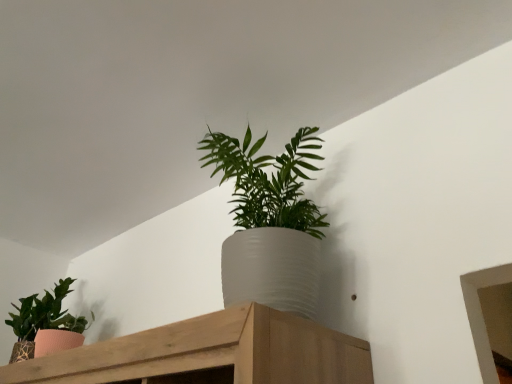
What are the coordinates of `white textured pot at center, which is the first houseplant in right-to-left order` in the screenshot? It's located at (269, 223).

This screenshot has height=384, width=512. Describe the element at coordinates (269, 223) in the screenshot. I see `white textured pot at center, the first houseplant from the front` at that location.

What is the approximate height of white textured pot at center, which is the first houseplant in right-to-left order?

22.92 inches.

Find the location of `textured pink pot at left, the 1th houseplant viewed from the left`. textured pink pot at left, the 1th houseplant viewed from the left is located at coordinates (46, 324).

Describe the element at coordinates (46, 324) in the screenshot. I see `textured pink pot at left, the 1th houseplant viewed from the left` at that location.

At what (x,y) coordinates should I click in order to perform the action: click on white textured pot at center, the first houseplant from the front. Please return your answer as a coordinate pair (x, y). The height and width of the screenshot is (384, 512). Looking at the image, I should click on (269, 223).

Considering the relative positions of textured pink pot at left, the second houseplant viewed from the front, and white textured pot at center, which ranks as the second houseplant in left-to-right order, in the image provided, is textured pink pot at left, the second houseplant viewed from the front, to the left or to the right of white textured pot at center, which ranks as the second houseplant in left-to-right order,?

From the image, it's evident that textured pink pot at left, the second houseplant viewed from the front, is to the left of white textured pot at center, which ranks as the second houseplant in left-to-right order.

Does textured pink pot at left, the 1th houseplant viewed from the left, lie behind white textured pot at center, which is the first houseplant in right-to-left order?

Yes, textured pink pot at left, the 1th houseplant viewed from the left, is further from the viewer.

Does point (48, 325) come farther from viewer compared to point (287, 150)?

Yes, it is behind point (287, 150).

From the image's perspective, is textured pink pot at left, the 1th houseplant viewed from the left, above or below white textured pot at center, positioned as the 2th houseplant in back-to-front order?

textured pink pot at left, the 1th houseplant viewed from the left, is situated lower than white textured pot at center, positioned as the 2th houseplant in back-to-front order, in the image.

From a real-world perspective, is textured pink pot at left, the second houseplant viewed from the front, positioned above or below white textured pot at center, positioned as the 2th houseplant in back-to-front order?

textured pink pot at left, the second houseplant viewed from the front, is below white textured pot at center, positioned as the 2th houseplant in back-to-front order.

Can you confirm if textured pink pot at left, the 1th houseplant viewed from the left, is thinner than white textured pot at center, which ranks as the second houseplant in left-to-right order?

Yes, textured pink pot at left, the 1th houseplant viewed from the left, is thinner than white textured pot at center, which ranks as the second houseplant in left-to-right order.

Looking at this image, in terms of height, does textured pink pot at left, the 1th houseplant viewed from the left, look taller or shorter compared to white textured pot at center, positioned as the 2th houseplant in back-to-front order?

Clearly, textured pink pot at left, the 1th houseplant viewed from the left, is shorter compared to white textured pot at center, positioned as the 2th houseplant in back-to-front order.

In the scene shown: Looking at the image, does textured pink pot at left, the second houseplant viewed from the front, seem bigger or smaller compared to white textured pot at center, the first houseplant from the front?

In the image, textured pink pot at left, the second houseplant viewed from the front, appears to be smaller than white textured pot at center, the first houseplant from the front.

Is textured pink pot at left, the second houseplant viewed from the front, situated inside white textured pot at center, which ranks as the second houseplant in left-to-right order, or outside?

textured pink pot at left, the second houseplant viewed from the front, cannot be found inside white textured pot at center, which ranks as the second houseplant in left-to-right order.

Does textured pink pot at left, the second houseplant viewed from the front, touch white textured pot at center, which is the first houseplant in right-to-left order?

No, textured pink pot at left, the second houseplant viewed from the front, is not beside white textured pot at center, which is the first houseplant in right-to-left order.

Is textured pink pot at left, placed as the 2th houseplant when sorted from right to left, oriented towards white textured pot at center, positioned as the 2th houseplant in back-to-front order?

No, textured pink pot at left, placed as the 2th houseplant when sorted from right to left, does not turn towards white textured pot at center, positioned as the 2th houseplant in back-to-front order.

How many degrees apart are the facing directions of textured pink pot at left, the second houseplant viewed from the front, and white textured pot at center, which is the first houseplant in right-to-left order?

The angular difference between textured pink pot at left, the second houseplant viewed from the front, and white textured pot at center, which is the first houseplant in right-to-left order, is 2.81 degrees.

Measure the distance from textured pink pot at left, placed as the 1th houseplant when sorted from back to front, to white textured pot at center, which is the first houseplant in right-to-left order.

34.75 inches.

Identify the location of houseplant that appears above the textured pink pot at left, the second houseplant viewed from the front (from a real-world perspective). The width and height of the screenshot is (512, 384). (269, 223).

Between white textured pot at center, the first houseplant from the front, and textured pink pot at left, placed as the 1th houseplant when sorted from back to front, which one appears on the left side from the viewer's perspective?

From the viewer's perspective, textured pink pot at left, placed as the 1th houseplant when sorted from back to front, appears more on the left side.

Is the position of white textured pot at center, positioned as the 2th houseplant in back-to-front order, less distant than that of textured pink pot at left, placed as the 2th houseplant when sorted from right to left?

That is True.

Is point (241, 188) closer to viewer compared to point (59, 285)?

Yes, point (241, 188) is closer to viewer.

Looking at this image, from the image's perspective, is white textured pot at center, which ranks as the second houseplant in left-to-right order, above textured pink pot at left, placed as the 1th houseplant when sorted from back to front?

Yes, from the image's perspective, white textured pot at center, which ranks as the second houseplant in left-to-right order, is over textured pink pot at left, placed as the 1th houseplant when sorted from back to front.

From a real-world perspective, who is located higher, white textured pot at center, positioned as the 2th houseplant in back-to-front order, or textured pink pot at left, the 1th houseplant viewed from the left?

white textured pot at center, positioned as the 2th houseplant in back-to-front order, from a real-world perspective.

Looking at their sizes, would you say white textured pot at center, positioned as the 2th houseplant in back-to-front order, is wider or thinner than textured pink pot at left, the 1th houseplant viewed from the left?

white textured pot at center, positioned as the 2th houseplant in back-to-front order, is wider than textured pink pot at left, the 1th houseplant viewed from the left.

Is white textured pot at center, positioned as the 2th houseplant in back-to-front order, taller than textured pink pot at left, placed as the 2th houseplant when sorted from right to left?

Correct, white textured pot at center, positioned as the 2th houseplant in back-to-front order, is much taller as textured pink pot at left, placed as the 2th houseplant when sorted from right to left.

Is white textured pot at center, the first houseplant from the front, bigger or smaller than textured pink pot at left, the 1th houseplant viewed from the left?

In the image, white textured pot at center, the first houseplant from the front, appears to be larger than textured pink pot at left, the 1th houseplant viewed from the left.

Is textured pink pot at left, placed as the 2th houseplant when sorted from right to left, completely or partially inside white textured pot at center, positioned as the 2th houseplant in back-to-front order?

No, textured pink pot at left, placed as the 2th houseplant when sorted from right to left, is not inside white textured pot at center, positioned as the 2th houseplant in back-to-front order.

Are white textured pot at center, which ranks as the second houseplant in left-to-right order, and textured pink pot at left, placed as the 2th houseplant when sorted from right to left, making contact?

No, white textured pot at center, which ranks as the second houseplant in left-to-right order, is not touching textured pink pot at left, placed as the 2th houseplant when sorted from right to left.

Could you tell me if white textured pot at center, positioned as the 2th houseplant in back-to-front order, is turned towards textured pink pot at left, the second houseplant viewed from the front?

No.

Can you tell me how much white textured pot at center, which is the first houseplant in right-to-left order, and textured pink pot at left, placed as the 2th houseplant when sorted from right to left, differ in facing direction?

The facing directions of white textured pot at center, which is the first houseplant in right-to-left order, and textured pink pot at left, placed as the 2th houseplant when sorted from right to left, are 2.81 degrees apart.

Where is `houseplant that is above the textured pink pot at left, the second houseplant viewed from the front (from the image's perspective)`? This screenshot has height=384, width=512. houseplant that is above the textured pink pot at left, the second houseplant viewed from the front (from the image's perspective) is located at coordinates (269, 223).

At what (x,y) coordinates should I click in order to perform the action: click on houseplant lying below the white textured pot at center, which is the first houseplant in right-to-left order (from the image's perspective). Please return your answer as a coordinate pair (x, y). Looking at the image, I should click on (46, 324).

The height and width of the screenshot is (384, 512). Identify the location of houseplant in front of the textured pink pot at left, the second houseplant viewed from the front. (269, 223).